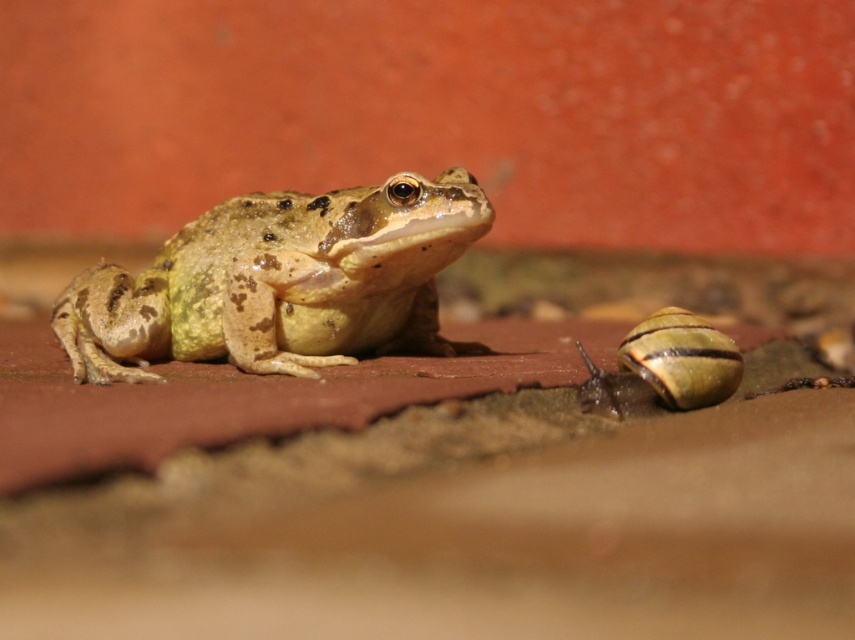
Who is positioned more to the right, camouflage skin frog at center or shiny brown shell at lower right?

shiny brown shell at lower right is more to the right.

Who is more distant from viewer, (245,349) or (674,317)?

The point (245,349) is behind.

Who is more forward, (452, 172) or (653, 364)?

Point (653, 364)

Identify the location of camouflage skin frog at center. (280, 282).